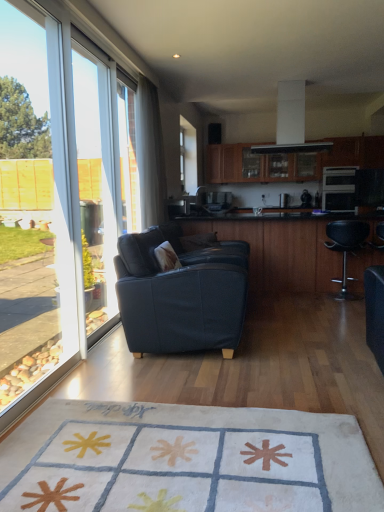
The width and height of the screenshot is (384, 512). What are the coordinates of `free space to the right of dark blue fabric couch at center` in the screenshot? It's located at (296, 342).